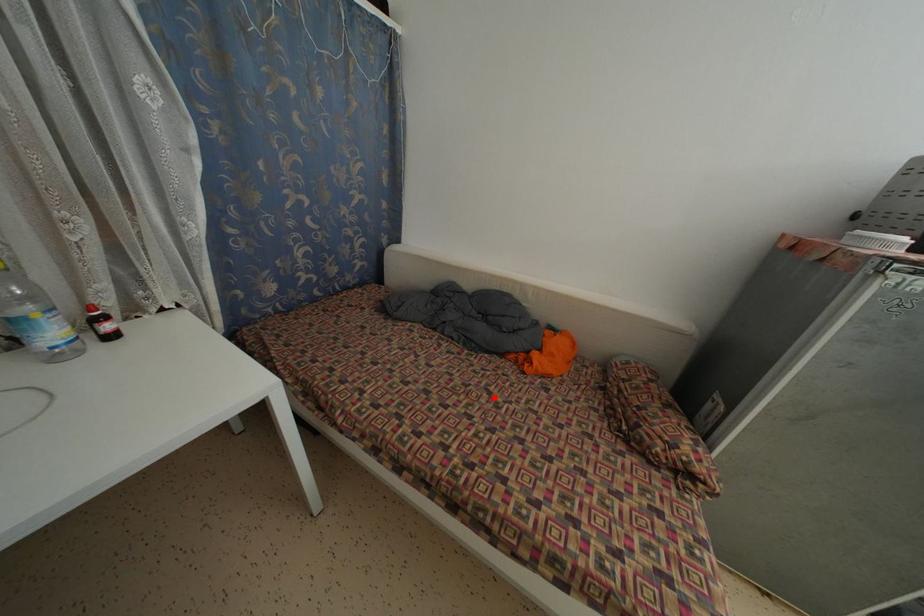
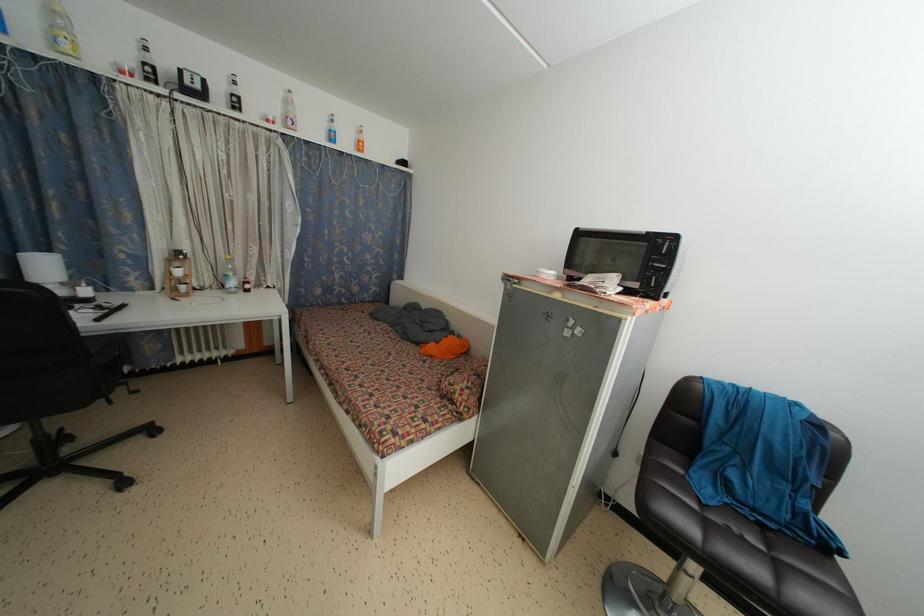
The point at the highlighted location is marked in the first image. Where is the corresponding point in the second image?

(394, 360)